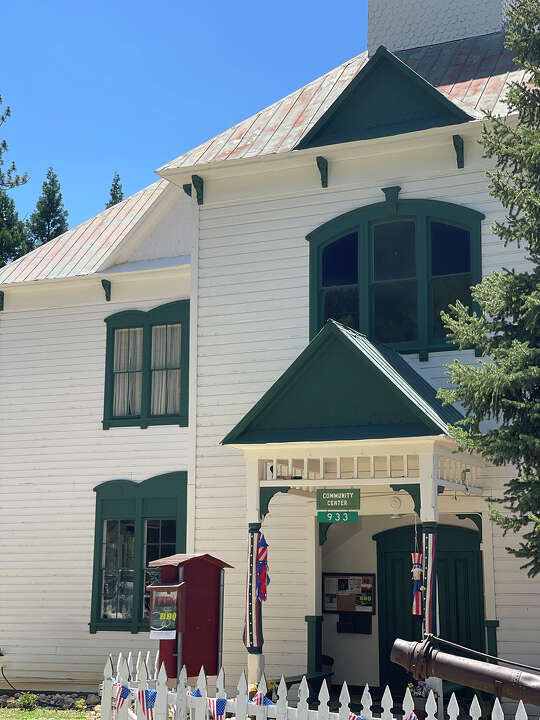
The image size is (540, 720). I want to click on window curtains, so click(x=160, y=351), click(x=174, y=386), click(x=120, y=356), click(x=137, y=361).